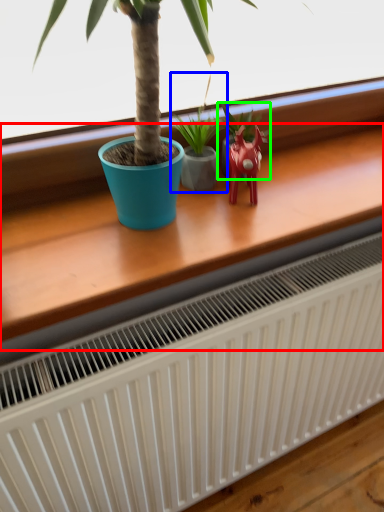
Question: Based on their relative distances, which object is farther from table (highlighted by a red box)? Choose from houseplant (highlighted by a blue box) and houseplant (highlighted by a green box).

Choices:
 (A) houseplant
 (B) houseplant

Answer: (B)